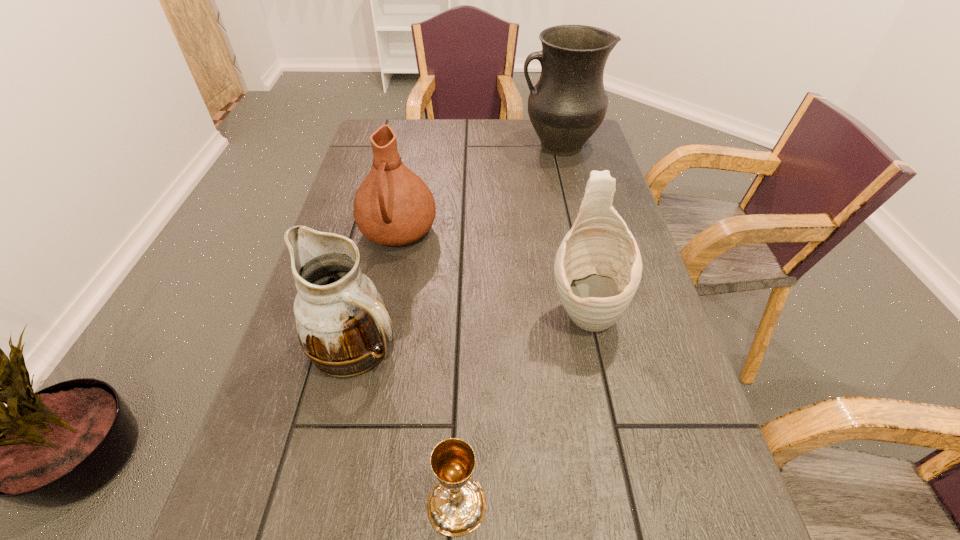
The image size is (960, 540). I want to click on the farthest pitcher, so click(x=568, y=104).

This screenshot has height=540, width=960. I want to click on the fourth nearest object, so coord(393,206).

The image size is (960, 540). In order to click on the third object from left to right in this screenshot , I will do `click(456, 506)`.

Identify the location of the shortest object. The height and width of the screenshot is (540, 960). (456, 506).

Find the location of a particular element. This screenshot has height=540, width=960. vacant space situated on the handle side of the farthest pitcher is located at coordinates (491, 146).

Where is `vacant space located 0.090m on the handle side of the farthest pitcher`? The width and height of the screenshot is (960, 540). vacant space located 0.090m on the handle side of the farthest pitcher is located at coordinates (491, 146).

At what (x,y) coordinates should I click in order to perform the action: click on free space located 0.230m on the handle side of the farthest pitcher. Please return your answer as a coordinate pair (x, y). Looking at the image, I should click on (446, 146).

At what (x,y) coordinates should I click in order to perform the action: click on free space located on the side of the second farthest object with the handle. Please return your answer as a coordinate pair (x, y). The height and width of the screenshot is (540, 960). Looking at the image, I should click on (360, 423).

Where is `vacant space situated 0.100m on the right of the nearest object`? This screenshot has width=960, height=540. vacant space situated 0.100m on the right of the nearest object is located at coordinates (553, 504).

The image size is (960, 540). I want to click on object that is at the far edge, so click(x=568, y=104).